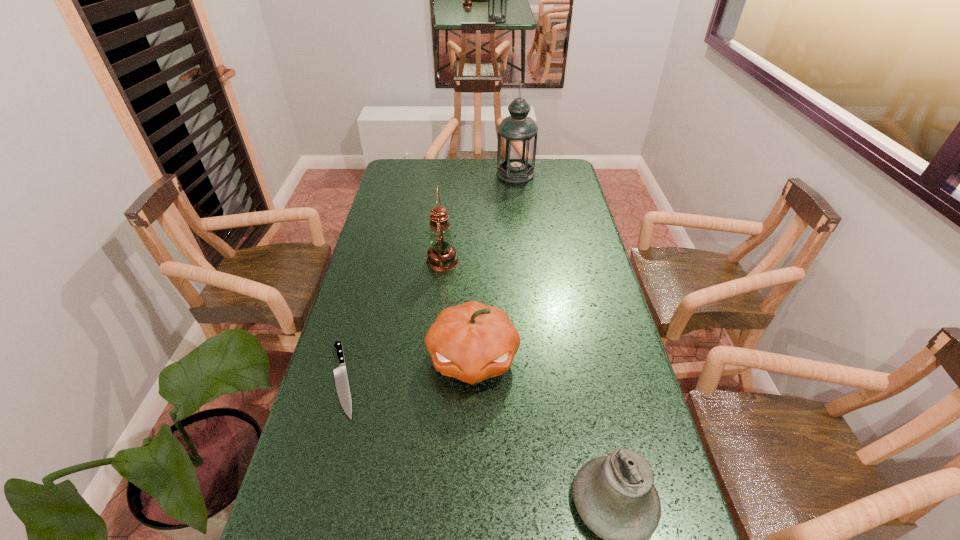
Where is `the right oil lamp`? This screenshot has width=960, height=540. the right oil lamp is located at coordinates (517, 134).

The width and height of the screenshot is (960, 540). What are the coordinates of `the farther oil lamp` in the screenshot? It's located at (517, 134).

At what (x,y) coordinates should I click in order to perform the action: click on the nearer oil lamp. Please return your answer as a coordinate pair (x, y). The width and height of the screenshot is (960, 540). Looking at the image, I should click on (441, 256).

What are the coordinates of `the shorter oil lamp` in the screenshot? It's located at (441, 256).

Identify the location of pumpkin. Image resolution: width=960 pixels, height=540 pixels. (472, 342).

Find the location of a particular element. steak knife is located at coordinates (340, 374).

What are the coordinates of `the leftmost object` in the screenshot? It's located at (340, 374).

You are a GUI agent. You are given a task and a screenshot of the screen. Output one action in this format:
    pyautogui.click(x=<x>, y=<y>)
    Task: Click on the free space located 0.400m on the front of the farther oil lamp
    The width and height of the screenshot is (960, 540).
    Given the screenshot: What is the action you would take?
    [x=523, y=239]

The width and height of the screenshot is (960, 540). I want to click on free space located on the right of the left oil lamp, so click(x=510, y=261).

At what (x,y) coordinates should I click in order to perform the action: click on free location located 0.290m on the front face of the pumpkin. Please return your answer as a coordinate pair (x, y). Looking at the image, I should click on (470, 517).